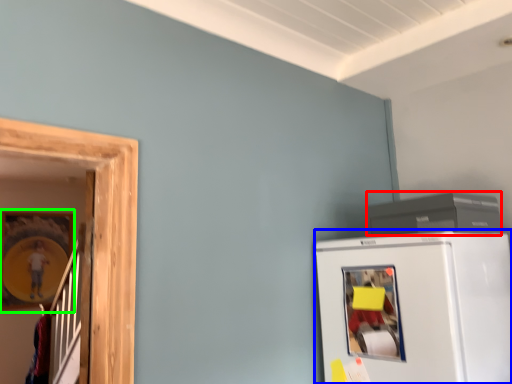
Question: Which is farther away from appliance (highlighted by a red box)? refrigerator (highlighted by a blue box) or picture frame (highlighted by a green box)?

Choices:
 (A) refrigerator
 (B) picture frame

Answer: (B)